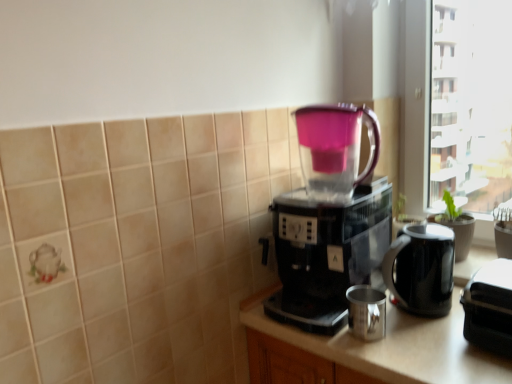
Question: From a real-world perspective, is transparent plastic pitcher at center below black plastic coffee maker at center?

Choices:
 (A) no
 (B) yes

Answer: (A)

Question: Does transparent plastic pitcher at center have a lesser height compared to black plastic coffee maker at center?

Choices:
 (A) yes
 (B) no

Answer: (A)

Question: Are transparent plastic pitcher at center and black plastic coffee maker at center located far from each other?

Choices:
 (A) yes
 (B) no

Answer: (B)

Question: Can you confirm if transparent plastic pitcher at center is bigger than black plastic coffee maker at center?

Choices:
 (A) yes
 (B) no

Answer: (B)

Question: Can you confirm if transparent plastic pitcher at center is taller than black plastic coffee maker at center?

Choices:
 (A) yes
 (B) no

Answer: (B)

Question: Is point (373, 311) positioned closer to the camera than point (293, 294)?

Choices:
 (A) closer
 (B) farther

Answer: (A)

Question: Is metallic silver mug at lower center in front of or behind black plastic coffee maker at center in the image?

Choices:
 (A) behind
 (B) front

Answer: (A)

Question: From the image's perspective, relative to black plastic coffee maker at center, is metallic silver mug at lower center above or below?

Choices:
 (A) below
 (B) above

Answer: (A)

Question: In terms of width, does metallic silver mug at lower center look wider or thinner when compared to black plastic coffee maker at center?

Choices:
 (A) thin
 (B) wide

Answer: (A)

Question: Based on their sizes in the image, would you say black plastic toaster at right is bigger or smaller than black glossy electric kettle at right?

Choices:
 (A) big
 (B) small

Answer: (B)

Question: From a real-world perspective, relative to black glossy electric kettle at right, is black plastic toaster at right vertically above or below?

Choices:
 (A) below
 (B) above

Answer: (A)

Question: Based on their positions, is black plastic toaster at right located to the left or right of black glossy electric kettle at right?

Choices:
 (A) left
 (B) right

Answer: (B)

Question: Considering the positions of black plastic toaster at right and black glossy electric kettle at right in the image, is black plastic toaster at right taller or shorter than black glossy electric kettle at right?

Choices:
 (A) short
 (B) tall

Answer: (A)

Question: Based on their sizes in the image, would you say black glossy electric kettle at right is bigger or smaller than transparent plastic pitcher at center?

Choices:
 (A) small
 (B) big

Answer: (A)

Question: Is black glossy electric kettle at right situated inside transparent plastic pitcher at center or outside?

Choices:
 (A) outside
 (B) inside

Answer: (A)